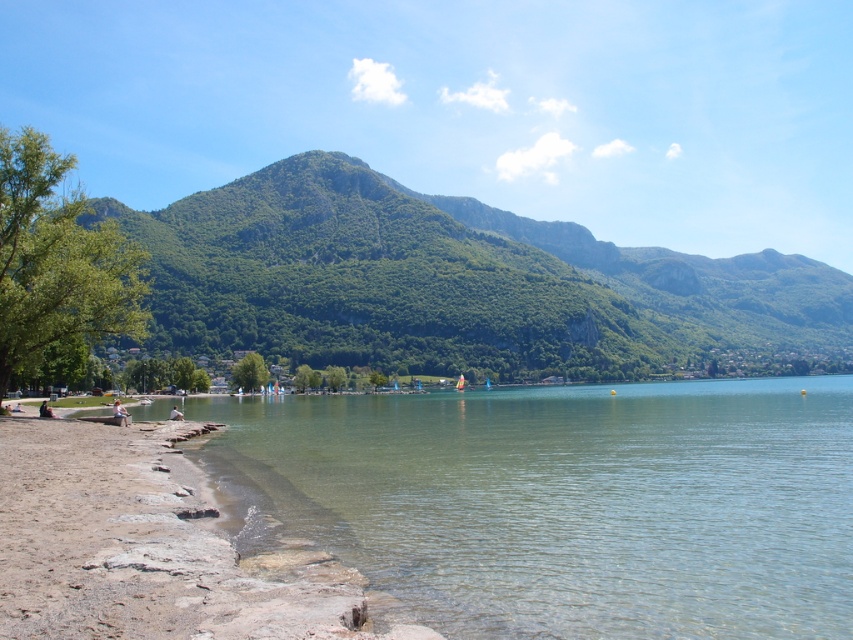
Question: Which object is farther from the camera taking this photo?

Choices:
 (A) clear water at shore left
 (B) green leafy mountain at center

Answer: (B)

Question: Does clear water at shore left have a larger size compared to green leafy mountain at center?

Choices:
 (A) yes
 (B) no

Answer: (B)

Question: Can you confirm if clear water at shore left is positioned to the right of green leafy mountain at center?

Choices:
 (A) yes
 (B) no

Answer: (B)

Question: Among these objects, which one is farthest from the camera?

Choices:
 (A) green leafy mountain at center
 (B) clear water at shore left

Answer: (A)

Question: Among these points, which one is farthest from the camera?

Choices:
 (A) (329, 243)
 (B) (798, 476)

Answer: (A)

Question: Does clear water at shore left appear on the left side of green leafy mountain at center?

Choices:
 (A) yes
 (B) no

Answer: (A)